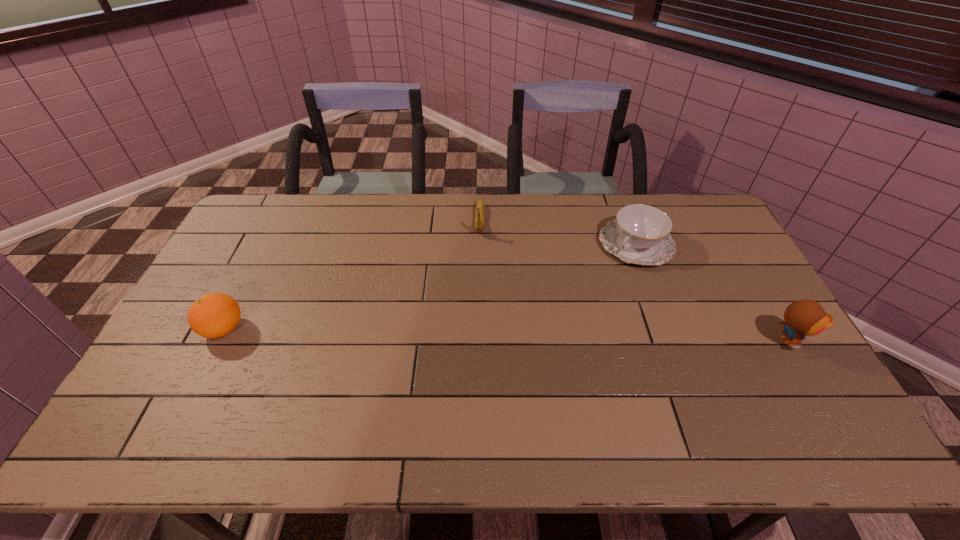
This screenshot has height=540, width=960. I want to click on vacant area situated on the handle side of the chinaware, so click(584, 295).

Find the location of `vacant space situated on the handle side of the chinaware`. vacant space situated on the handle side of the chinaware is located at coordinates (607, 273).

The image size is (960, 540). In order to click on banana located in the far edge section of the desktop in this screenshot , I will do `click(480, 210)`.

You are a GUI agent. You are given a task and a screenshot of the screen. Output one action in this format:
    pyautogui.click(x=<x>, y=<y>)
    Task: Click on the chinaware at the far edge
    The image size is (960, 540).
    Given the screenshot: What is the action you would take?
    pyautogui.click(x=640, y=234)

Where is `object that is at the left edge`? object that is at the left edge is located at coordinates (214, 315).

This screenshot has width=960, height=540. Identify the location of object at the right edge. (807, 317).

At what (x,y) coordinates should I click in order to perform the action: click on free space at the far edge. Please return your answer as a coordinate pair (x, y). The width and height of the screenshot is (960, 540). Looking at the image, I should click on (445, 229).

In the image, there is a desktop. Where is `vacant space at the near edge`? vacant space at the near edge is located at coordinates (556, 405).

You are a GUI agent. You are given a task and a screenshot of the screen. Output one action in this format:
    pyautogui.click(x=<x>, y=<y>)
    Task: Click on the vacant space at the left edge of the desktop
    The image size is (960, 540).
    Given the screenshot: What is the action you would take?
    pyautogui.click(x=189, y=335)

This screenshot has width=960, height=540. In the image, there is a desktop. In order to click on free region at the right edge in this screenshot , I will do `click(744, 305)`.